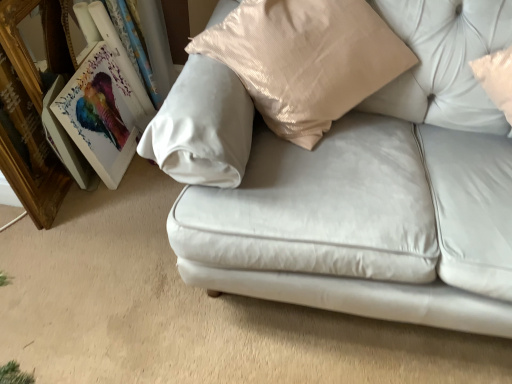
Question: Based on their positions, is wooden gold picture frame at left, the 2th picture frame when ordered from right to left, located to the left or right of satin white couch at center?

Choices:
 (A) left
 (B) right

Answer: (A)

Question: Is wooden gold picture frame at left, positioned as the 1th picture frame in left-to-right order, wider or thinner than satin white couch at center?

Choices:
 (A) wide
 (B) thin

Answer: (B)

Question: Which object is the closest to the matte wooden picture frame at left, which ranks as the 2th picture frame in left-to-right order?

Choices:
 (A) wooden gold picture frame at left, the 2th picture frame when ordered from right to left
 (B) satin white couch at center

Answer: (A)

Question: Which is farther from the wooden gold picture frame at left, the 2th picture frame when ordered from right to left?

Choices:
 (A) satin white couch at center
 (B) matte wooden picture frame at left, which ranks as the 2th picture frame in left-to-right order

Answer: (A)